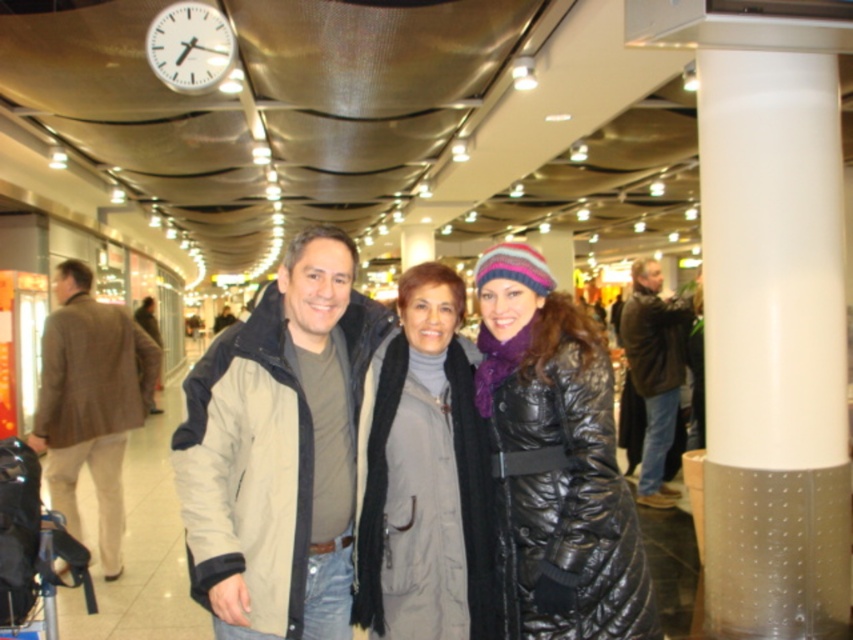
Question: Which object is closer to the camera taking this photo?

Choices:
 (A) gray matte jacket at center
 (B) brown textured jacket at left
 (C) brown leather jacket at right
 (D) white plastic clock at upper left

Answer: (A)

Question: Is matte beige jacket at center closer to the viewer compared to brown leather jacket at right?

Choices:
 (A) no
 (B) yes

Answer: (B)

Question: Which point is closer to the camera?

Choices:
 (A) matte beige jacket at center
 (B) brown leather jacket at right

Answer: (A)

Question: Estimate the real-world distances between objects in this image. Which object is closer to the matte beige jacket at center?

Choices:
 (A) white plastic clock at upper left
 (B) brown leather jacket at right

Answer: (A)

Question: Can you confirm if shiny black coat at center is wider than brown textured jacket at left?

Choices:
 (A) no
 (B) yes

Answer: (A)

Question: Is beige fabric jacket at center to the right of brown textured jacket at left from the viewer's perspective?

Choices:
 (A) no
 (B) yes

Answer: (B)